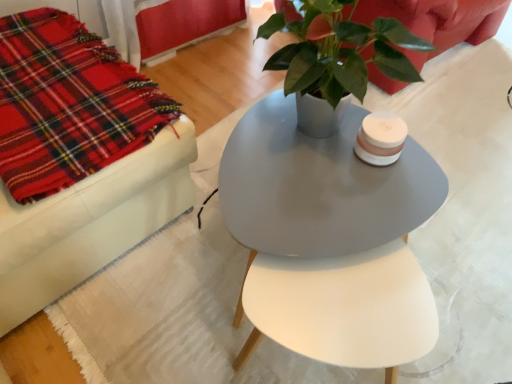
This screenshot has height=384, width=512. Find the location of `free space above matte gray table at center (from a real-world perspective)`. free space above matte gray table at center (from a real-world perspective) is located at coordinates pos(316,180).